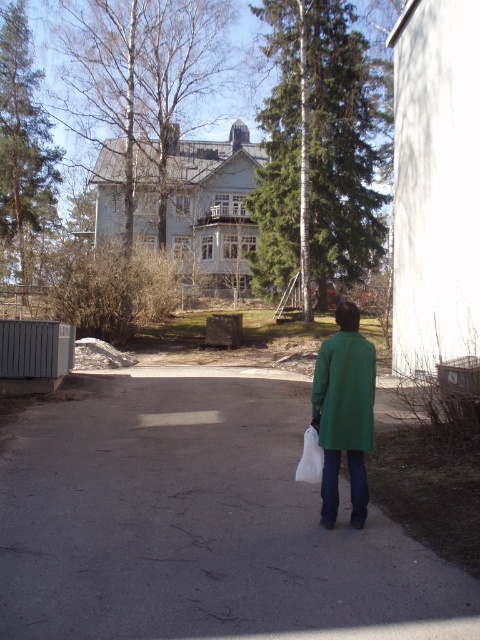
You are standing at the edge of the gray asphalt pavement at center and want to reach the green matte jacket at lower center. Which direction should you move to get closer to the jacket?

Since the gray asphalt pavement at center is located below the green matte jacket at lower center, you should move upward to reach the jacket.

You are standing at the point labeled point (153, 547) and want to walk to the point labeled point (361, 404). Which direction should you face to walk directly towards your destination?

You should face south to walk directly towards point (361, 404) from point (153, 547).

You are a delivery robot with a 1.5 meter wide package. You need to move from the gray asphalt pavement at center to the green matte jacket at lower center. Is there enough space between them for your package?

The distance between the gray asphalt pavement at center and the green matte jacket at lower center is 2.98 meters, so yes, the package can fit as it is wider than the required space.